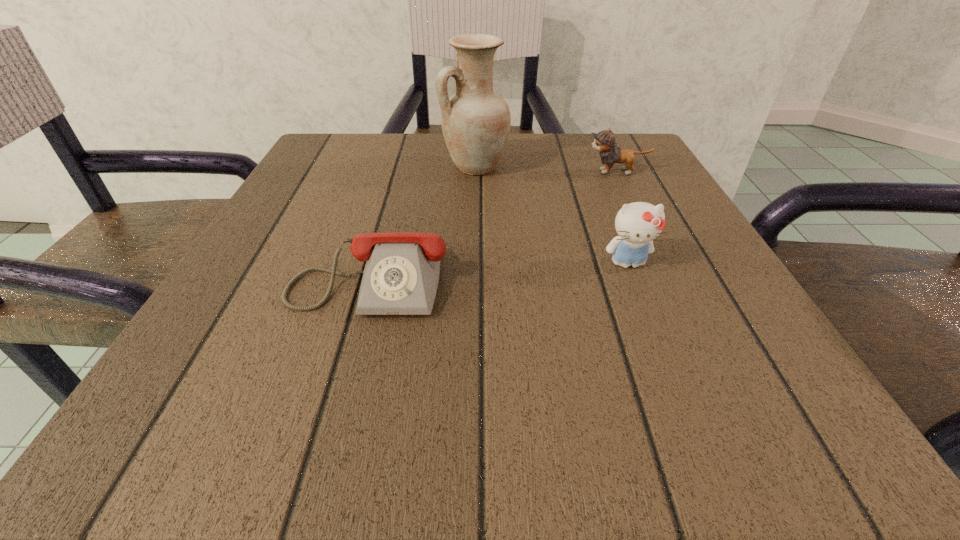
You are a GUI agent. You are given a task and a screenshot of the screen. Output one action in this format:
    pyautogui.click(x=<x>, y=<y>)
    Task: Click on the pottery
    This screenshot has width=960, height=540.
    Given the screenshot: What is the action you would take?
    pyautogui.click(x=475, y=121)

Locate an element on the screen. the nearer kitten is located at coordinates (637, 224).

Find the location of a particular element. The height and width of the screenshot is (540, 960). the taller kitten is located at coordinates (637, 224).

Locate an element on the screen. This screenshot has height=540, width=960. the second shortest object is located at coordinates (604, 141).

Where is `the farther kitten`? The image size is (960, 540). the farther kitten is located at coordinates (604, 141).

The width and height of the screenshot is (960, 540). What are the coordinates of `the shortest object` in the screenshot? It's located at (401, 275).

Identify the location of vacant space located 0.330m on the front of the pottery. The height and width of the screenshot is (540, 960). (473, 301).

The image size is (960, 540). I want to click on vacant space located on the front-facing side of the nearer kitten, so click(x=653, y=326).

The image size is (960, 540). I want to click on vacant area situated 0.240m on the front-facing side of the shorter kitten, so click(467, 172).

The image size is (960, 540). Identify the location of vacant position located 0.290m on the front-facing side of the shorter kitten. (443, 172).